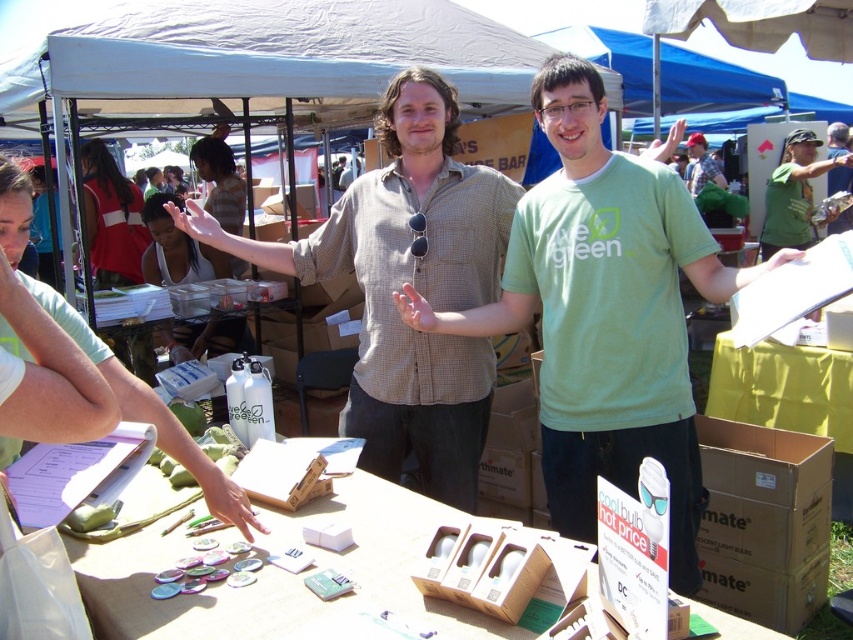
This screenshot has width=853, height=640. What are the coordinates of `light brown checkered shirt at center` in the screenshot? It's located at (409, 284).

Where is `light brown checkered shirt at center`? The image size is (853, 640). light brown checkered shirt at center is located at coordinates (409, 284).

Does matte white handbag at center lie in front of red fabric dress at upper left?

Yes, it is.

Can you confirm if matte white handbag at center is positioned below red fabric dress at upper left?

Yes, matte white handbag at center is below red fabric dress at upper left.

The height and width of the screenshot is (640, 853). What are the coordinates of `matte white handbag at center` in the screenshot? It's located at (177, 250).

Can you confirm if green matte shirt at center is positioned to the left of brown cardboard box at lower right?

Correct, you'll find green matte shirt at center to the left of brown cardboard box at lower right.

Does green matte shirt at center have a lesser width compared to brown cardboard box at lower right?

No.

Is point (509, 252) in front of point (807, 579)?

Yes.

Image resolution: width=853 pixels, height=640 pixels. I want to click on green matte shirt at center, so click(604, 314).